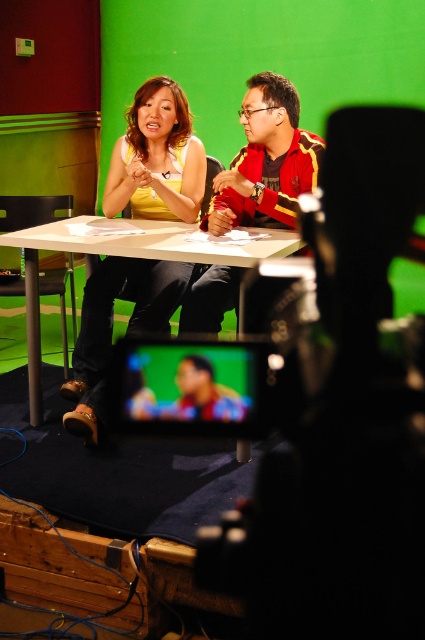
Question: Which is nearer to the red-yellow striped shirt at center?

Choices:
 (A) matte plastic screen at center
 (B) white plastic table at center

Answer: (B)

Question: Which point is closer to the camera?

Choices:
 (A) matte plastic screen at center
 (B) yellow fabric top at center
 (C) white plastic table at center

Answer: (C)

Question: Is yellow fabric top at center above matte plastic screen at center?

Choices:
 (A) no
 (B) yes

Answer: (B)

Question: Can you confirm if red-yellow striped shirt at center is positioned to the left of white plastic table at center?

Choices:
 (A) yes
 (B) no

Answer: (B)

Question: Is yellow fabric top at center below matte plastic screen at center?

Choices:
 (A) no
 (B) yes

Answer: (A)

Question: Which point is farther to the camera?

Choices:
 (A) white plastic table at center
 (B) yellow fabric top at center
 (C) red-yellow striped shirt at center
 (D) matte plastic screen at center

Answer: (D)